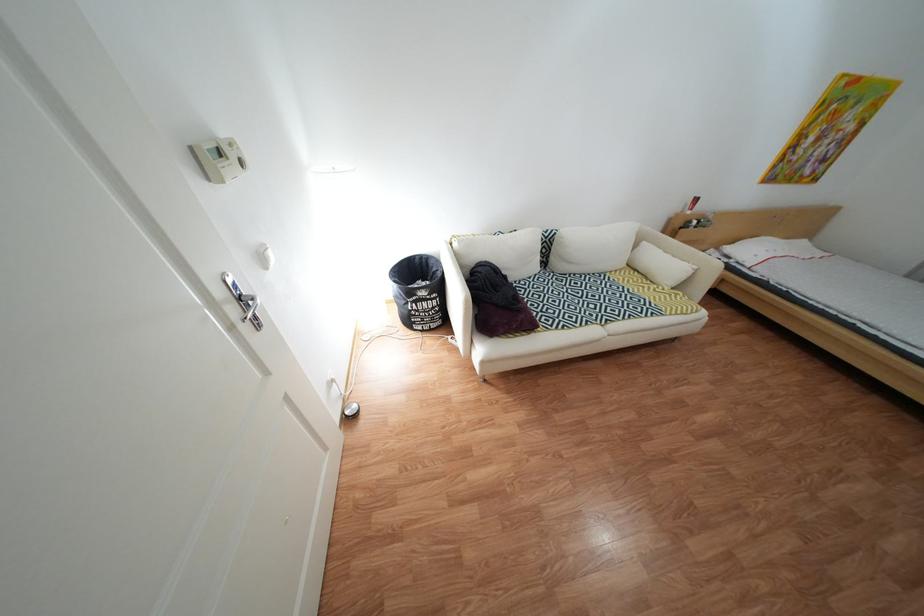
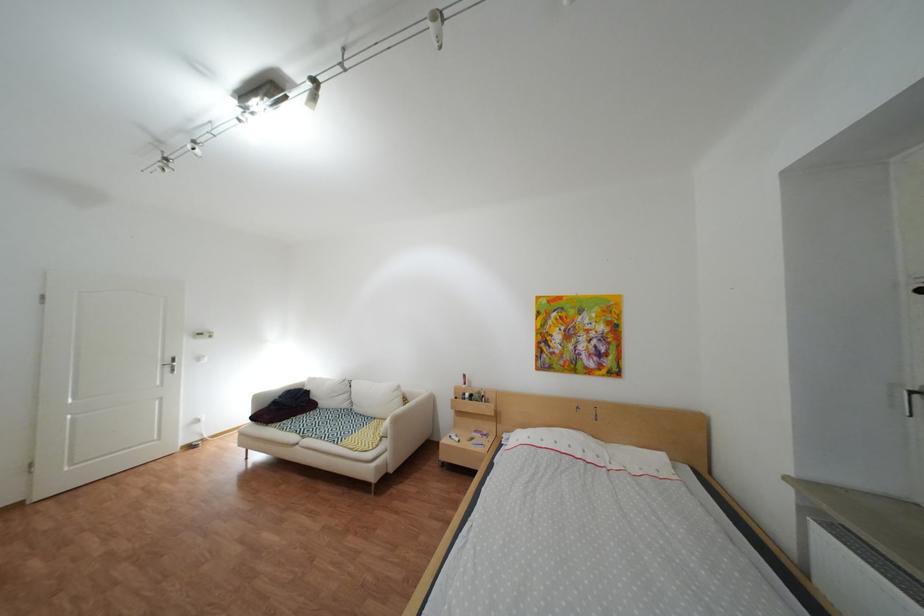
Where in the second image is the point corresponding to point 706,223 from the first image?

(480, 395)